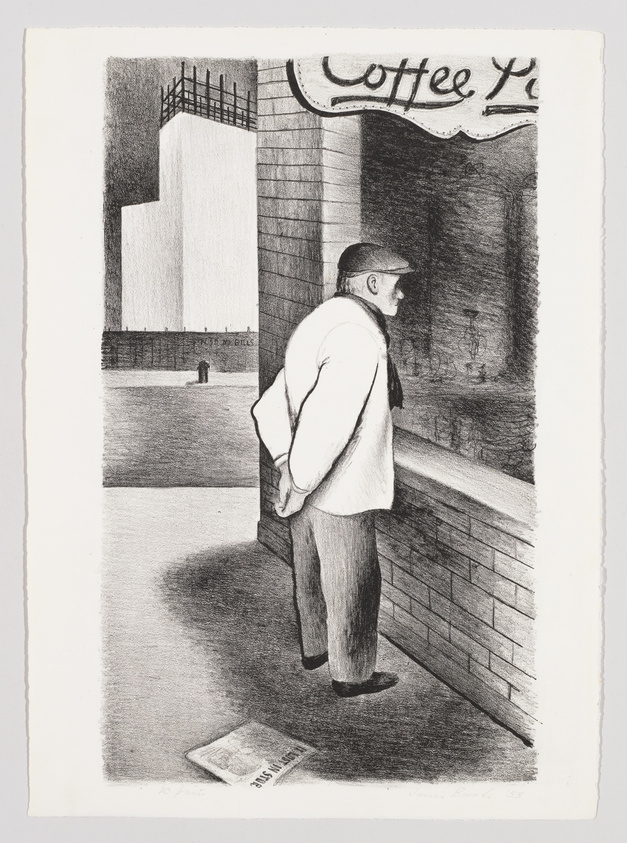
The height and width of the screenshot is (843, 627). Identify the location of trash can. (203, 371).